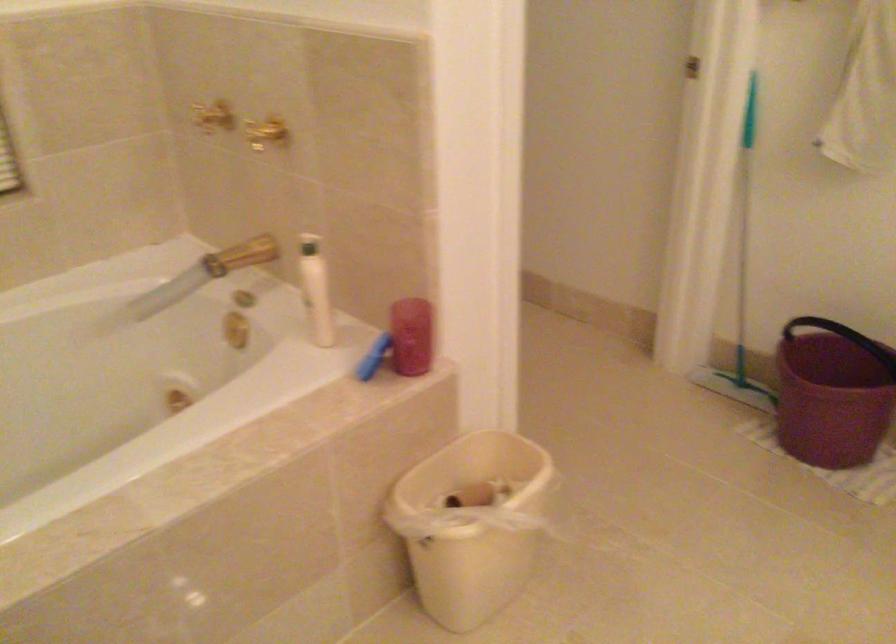
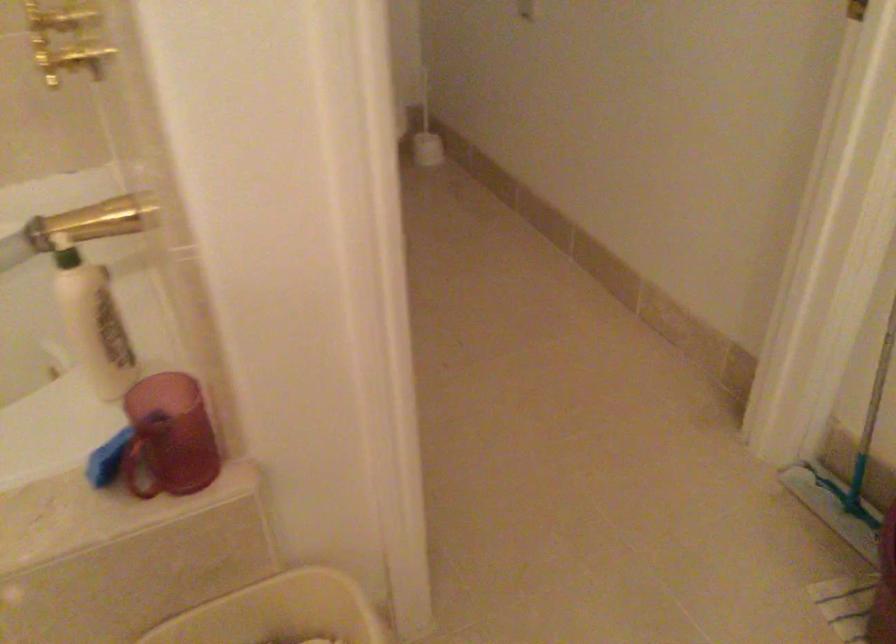
Where in the second image is the point corresponding to pixel 263 133 from the first image?

(69, 61)